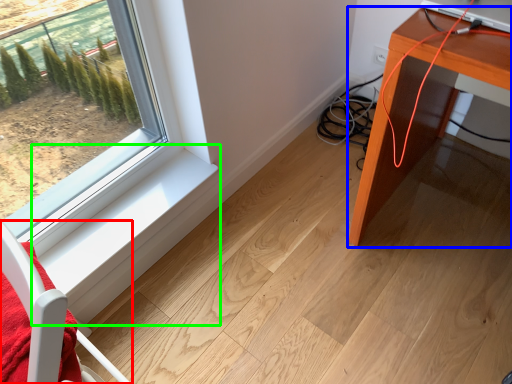
Question: Estimate the real-world distances between objects in this image. Which object is closer to furniture (highlighted by a red box), table (highlighted by a blue box) or window sill (highlighted by a green box)?

Choices:
 (A) table
 (B) window sill

Answer: (B)